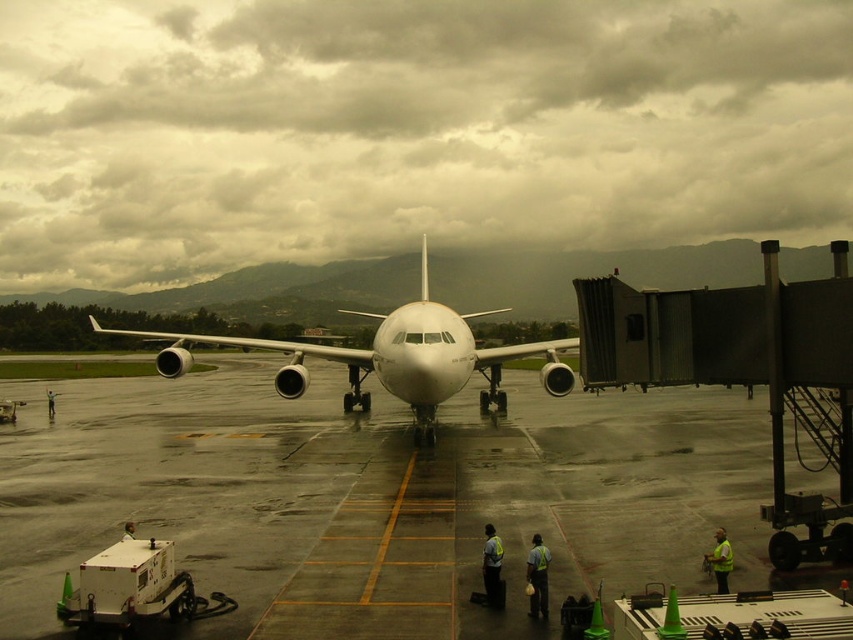
You are a passenger who just got off the airplane and is standing on the smooth concrete tarmac at center. You want to find the green reflective vest at center. Where should you look relative to your current position?

The green reflective vest at center is above the smooth concrete tarmac at center, so you should look upwards to find it.

You are a maintenance worker carrying a 10 meter long ladder. You need to place it between the smooth concrete tarmac at center and the green reflective vest at center without touching either. Is this possible?

The smooth concrete tarmac at center and green reflective vest at center are 12.23 meters apart. Since the ladder is 10 meters long, placing it between them without touching either is possible as there is enough space.

You are an airport maintenance worker standing near the reflective yellow vest at center and the yellow reflective vest at lower right. You need to choose the wider one to place on the jet bridge for safety. Which vest should you select?

The yellow reflective vest at lower right is wider than the reflective yellow vest at center, so you should select the yellow reflective vest at lower right for placement on the jet bridge.